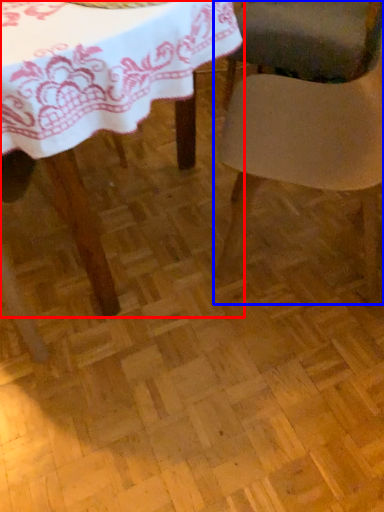
Question: Which of the following is the closest to the observer, table (highlighted by a red box) or chair (highlighted by a blue box)?

Choices:
 (A) table
 (B) chair

Answer: (A)